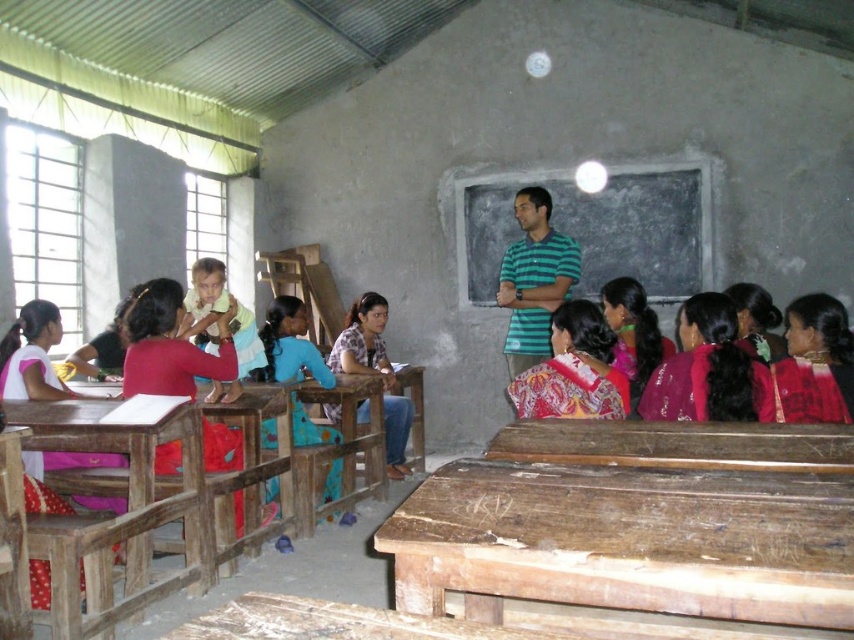
Is wooden table at lower center bigger than wooden table at center?

Indeed, wooden table at lower center has a larger size compared to wooden table at center.

This screenshot has width=854, height=640. Describe the element at coordinates (626, 541) in the screenshot. I see `wooden table at lower center` at that location.

Does point (816, 604) lie in front of point (550, 424)?

Yes, point (816, 604) is closer to viewer.

Find the location of a particular element. The height and width of the screenshot is (640, 854). wooden table at lower center is located at coordinates (626, 541).

Image resolution: width=854 pixels, height=640 pixels. What are the coordinates of `black chalkboard at center` in the screenshot? It's located at (598, 228).

Is point (597, 572) positioned before point (149, 513)?

Yes, point (597, 572) is in front of point (149, 513).

Is wooden table at lower center positioned in front of wooden table at lower left?

That is True.

At what (x,y) coordinates should I click in order to perform the action: click on wooden table at lower center. Please return your answer as a coordinate pair (x, y). The height and width of the screenshot is (640, 854). Looking at the image, I should click on (626, 541).

The image size is (854, 640). What are the coordinates of `wooden table at lower center` in the screenshot? It's located at (626, 541).